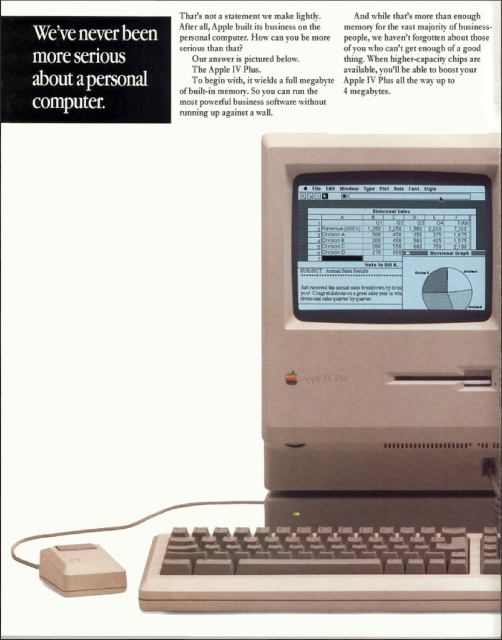
You are setting up a desk and need to place the matte plastic monitor at center and the beige plastic mouse at lower left. Based on the scene, which object should be placed higher on the desk?

The matte plastic monitor at center should be placed higher on the desk since it is located above the beige plastic mouse at lower left in the scene.

You are setting up a desk for a new computer. You have the beige plastic apple iv plus at center and the beige plastic mouse at lower left. If you want to place the mouse closer to the keyboard, where should you position it relative to the computer?

The beige plastic mouse at lower left should be positioned to the lower left of the beige plastic apple iv plus at center to place it closer to the keyboard.